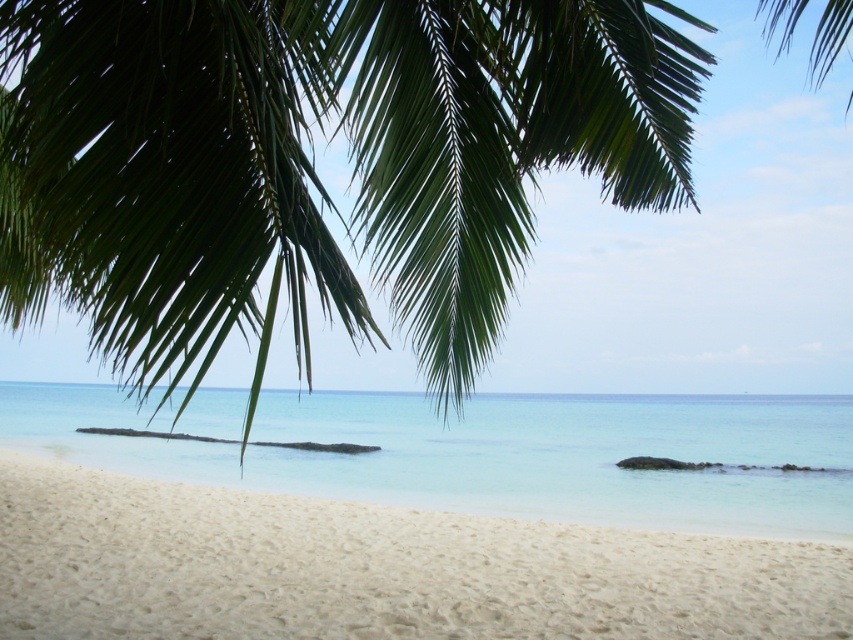
Is green leafy palm tree at upper left taller than clear water at lower center?

Yes, green leafy palm tree at upper left is taller than clear water at lower center.

Who is higher up, green leafy palm tree at upper left or clear water at lower center?

green leafy palm tree at upper left is higher up.

Describe the element at coordinates (312, 163) in the screenshot. I see `green leafy palm tree at upper left` at that location.

What are the coordinates of `green leafy palm tree at upper left` in the screenshot? It's located at (312, 163).

Measure the distance between green leafy palm tree at upper left and camera.

green leafy palm tree at upper left is 2.36 meters away from camera.

Is green leafy palm tree at upper left bigger than white sandy beach at lower left?

Yes, green leafy palm tree at upper left is bigger than white sandy beach at lower left.

Which is behind, point (200, 122) or point (169, 636)?

The point (169, 636) is more distant.

I want to click on green leafy palm tree at upper left, so click(x=312, y=163).

Is white sandy beach at lower left shorter than clear water at lower center?

Yes.

Does white sandy beach at lower left have a lesser width compared to clear water at lower center?

Indeed, white sandy beach at lower left has a lesser width compared to clear water at lower center.

What do you see at coordinates (376, 568) in the screenshot? I see `white sandy beach at lower left` at bounding box center [376, 568].

Identify the location of white sandy beach at lower left. (376, 568).